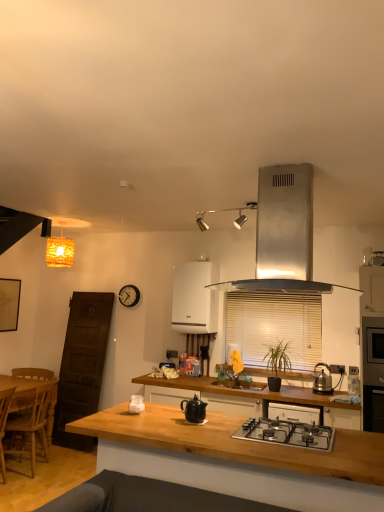
The height and width of the screenshot is (512, 384). Identify the location of free space in front of black ceramic teapot at center, acting as the 4th kitchen appliance starting from the back. (188, 425).